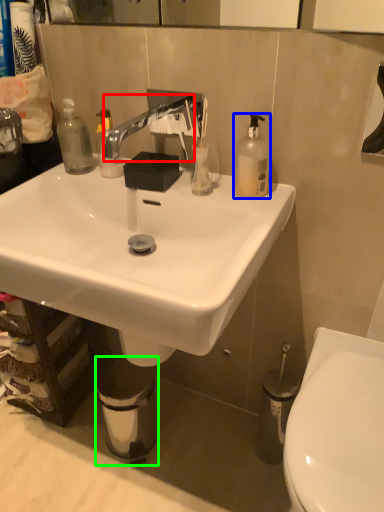
Question: Which object is positioned farthest from faucet (highlighted by a red box)? Select from bottle (highlighted by a blue box) and trash bin/can (highlighted by a green box).

Choices:
 (A) bottle
 (B) trash bin/can

Answer: (B)